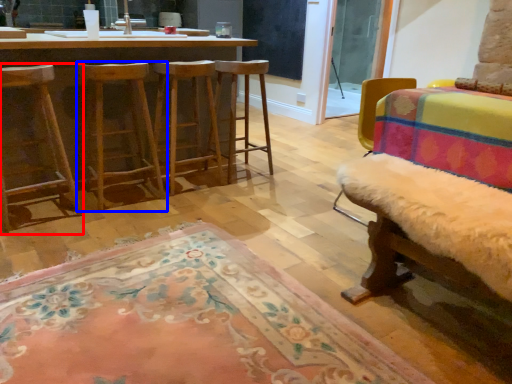
Question: Which object appears farthest to the camera in this image, chair (highlighted by a red box) or stool (highlighted by a blue box)?

Choices:
 (A) chair
 (B) stool

Answer: (B)